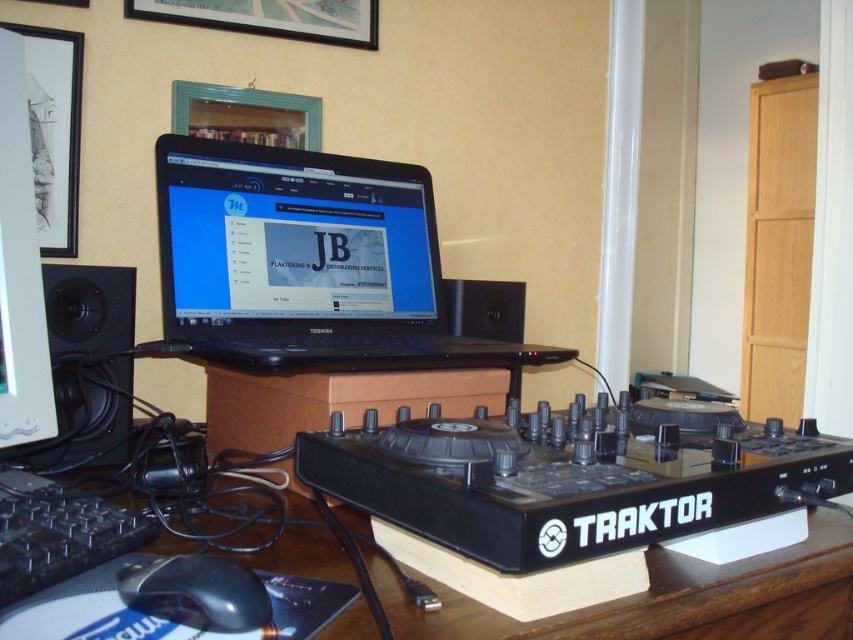
Looking at this image, is black plastic keyboard at lower left further to the viewer compared to black plastic speaker at center?

No, black plastic keyboard at lower left is in front of black plastic speaker at center.

What do you see at coordinates (57, 534) in the screenshot? The width and height of the screenshot is (853, 640). I see `black plastic keyboard at lower left` at bounding box center [57, 534].

Identify the location of black plastic keyboard at lower left. (57, 534).

Measure the distance between black matte speaker at left and black plastic keyboard at lower left.

black matte speaker at left and black plastic keyboard at lower left are 8.16 inches apart from each other.

Who is taller, black matte speaker at left or black plastic keyboard at lower left?

Standing taller between the two is black matte speaker at left.

Where is `black matte speaker at left`? This screenshot has height=640, width=853. black matte speaker at left is located at coordinates (86, 365).

Between black plastic laptop at center and black plastic mouse at lower left, which one has less height?

black plastic mouse at lower left is shorter.

Does point (576, 552) lie in front of point (250, 618)?

No.

The image size is (853, 640). What do you see at coordinates (589, 486) in the screenshot? I see `black plastic laptop at center` at bounding box center [589, 486].

Locate an element on the screen. This screenshot has height=640, width=853. black plastic laptop at center is located at coordinates [x=589, y=486].